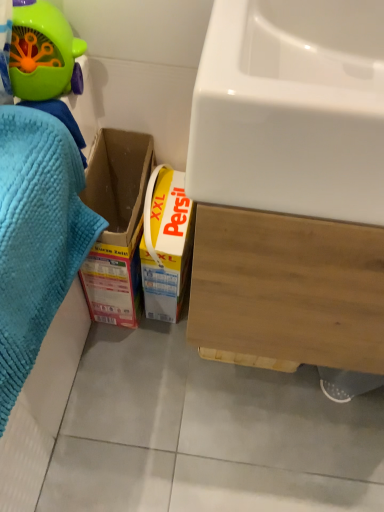
Question: From the image's perspective, would you say green plastic toy at upper left is positioned over blue textured towel at left?

Choices:
 (A) yes
 (B) no

Answer: (A)

Question: Considering the relative positions of green plastic toy at upper left and blue textured towel at left in the image provided, is green plastic toy at upper left to the left of blue textured towel at left from the viewer's perspective?

Choices:
 (A) yes
 (B) no

Answer: (B)

Question: From the image's perspective, is green plastic toy at upper left located beneath blue textured towel at left?

Choices:
 (A) yes
 (B) no

Answer: (B)

Question: Does green plastic toy at upper left have a larger size compared to blue textured towel at left?

Choices:
 (A) no
 (B) yes

Answer: (A)

Question: Does green plastic toy at upper left have a smaller size compared to blue textured towel at left?

Choices:
 (A) yes
 (B) no

Answer: (A)

Question: Is green plastic toy at upper left shorter than blue textured towel at left?

Choices:
 (A) yes
 (B) no

Answer: (A)

Question: From the image's perspective, is blue textured towel at left under green plastic toy at upper left?

Choices:
 (A) yes
 (B) no

Answer: (A)

Question: Is blue textured towel at left positioned far away from green plastic toy at upper left?

Choices:
 (A) no
 (B) yes

Answer: (A)

Question: Is blue textured towel at left facing towards green plastic toy at upper left?

Choices:
 (A) yes
 (B) no

Answer: (B)

Question: From the image's perspective, is blue textured towel at left on green plastic toy at upper left?

Choices:
 (A) yes
 (B) no

Answer: (B)

Question: Is blue textured towel at left touching green plastic toy at upper left?

Choices:
 (A) no
 (B) yes

Answer: (A)

Question: Considering the relative positions of blue textured towel at left and green plastic toy at upper left in the image provided, is blue textured towel at left to the right of green plastic toy at upper left from the viewer's perspective?

Choices:
 (A) yes
 (B) no

Answer: (B)

Question: From a real-world perspective, is white glossy sink at upper right on top of blue textured towel at left?

Choices:
 (A) yes
 (B) no

Answer: (A)